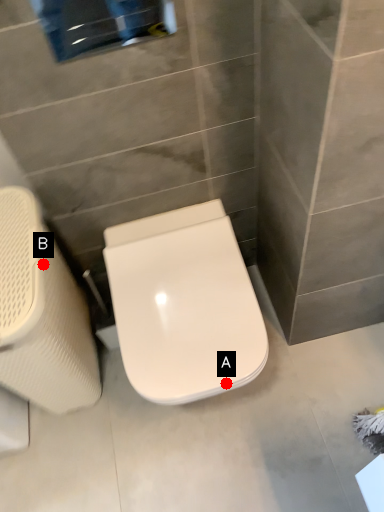
Question: Two points are circled on the image, labeled by A and B beside each circle. Which point is closer to the camera?

Choices:
 (A) A is closer
 (B) B is closer

Answer: (A)